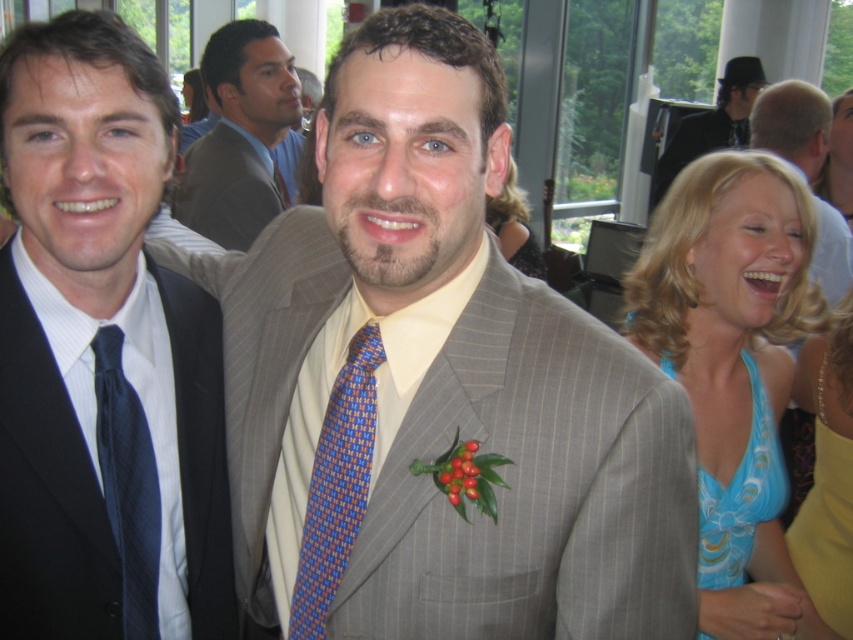
Question: Does matte brown suit at upper center appear on the right side of blue satin dress at lower right?

Choices:
 (A) yes
 (B) no

Answer: (B)

Question: Based on their relative distances, which object is nearer to the blue floral dress at right?

Choices:
 (A) blue woven tie at center
 (B) matte black suit at left

Answer: (A)

Question: Which object is farther from the camera taking this photo?

Choices:
 (A) matte black suit at left
 (B) blue silk dress at right
 (C) light gray pinstripe suit at center

Answer: (C)

Question: Which of the following is the closest to the observer?

Choices:
 (A) (61, 97)
 (B) (770, 477)
 (C) (151, 499)
 (D) (804, 493)

Answer: (A)

Question: Can you confirm if blue woven tie at center is thinner than black pinstripe suit at upper right?

Choices:
 (A) yes
 (B) no

Answer: (A)

Question: Can you confirm if matte black suit at left is positioned to the left of matte brown suit at upper center?

Choices:
 (A) no
 (B) yes

Answer: (A)